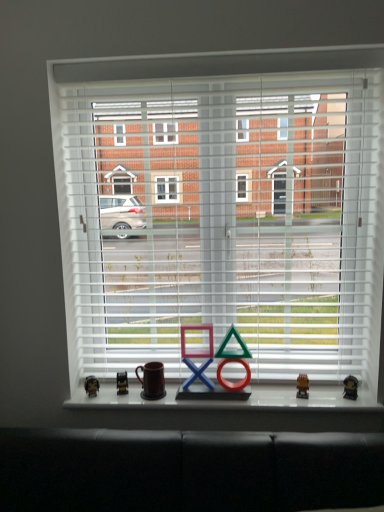
From the picture: What is the approximate height of metallic gold figurine at center, acting as the 3th miniature starting from the left?

3.14 inches.

Locate an element on the screen. The width and height of the screenshot is (384, 512). metallic gold figurine at right, which is the first miniature in right-to-left order is located at coordinates (350, 387).

What do you see at coordinates (217, 368) in the screenshot? This screenshot has width=384, height=512. I see `matte plastic game piece at center` at bounding box center [217, 368].

You are a GUI agent. You are given a task and a screenshot of the screen. Output one action in this format:
    pyautogui.click(x=<x>, y=<y>)
    Task: Click on the metallic silver figurine at lower left, the first miniature from the left
    This screenshot has width=384, height=512.
    Given the screenshot: What is the action you would take?
    pyautogui.click(x=91, y=386)

Locate an element on the screen. The height and width of the screenshot is (512, 384). metallic gold miniature at lower left, which appears as the 3th miniature when viewed from the right is located at coordinates (122, 383).

The height and width of the screenshot is (512, 384). Identify the location of metallic gold figurine at center, which is counted as the 2th miniature, starting from the right. (302, 386).

Is point (356, 383) closer or farther from the camera than point (308, 389)?

Point (356, 383) appears to be closer to the viewer than point (308, 389).

From the image's perspective, which is below, metallic gold figurine at right, which is the first miniature in right-to-left order, or metallic gold figurine at center, which is counted as the 2th miniature, starting from the right?

metallic gold figurine at right, which is the first miniature in right-to-left order, from the image's perspective.

Considering the relative sizes of metallic gold figurine at right, the fourth miniature in the left-to-right sequence, and metallic gold figurine at center, which is counted as the 2th miniature, starting from the right, in the image provided, is metallic gold figurine at right, the fourth miniature in the left-to-right sequence, thinner than metallic gold figurine at center, which is counted as the 2th miniature, starting from the right,?

Yes.

Considering the positions of objects metallic gold figurine at right, the fourth miniature in the left-to-right sequence, and metallic gold figurine at center, which is counted as the 2th miniature, starting from the right, in the image provided, who is behind, metallic gold figurine at right, the fourth miniature in the left-to-right sequence, or metallic gold figurine at center, which is counted as the 2th miniature, starting from the right,?

metallic gold figurine at center, which is counted as the 2th miniature, starting from the right.

Where is `mug to the right of metallic silver figurine at lower left, the 4th miniature when ordered from right to left`? The height and width of the screenshot is (512, 384). mug to the right of metallic silver figurine at lower left, the 4th miniature when ordered from right to left is located at coordinates (152, 380).

Is point (91, 395) behind point (148, 394)?

Yes, point (91, 395) is behind point (148, 394).

Is the depth of metallic silver figurine at lower left, the first miniature from the left, greater than that of brown matte mug at center?

Yes, the depth of metallic silver figurine at lower left, the first miniature from the left, is greater than that of brown matte mug at center.

Does metallic silver figurine at lower left, the 4th miniature when ordered from right to left, have a lesser height compared to brown matte mug at center?

Indeed, metallic silver figurine at lower left, the 4th miniature when ordered from right to left, has a lesser height compared to brown matte mug at center.

Does brown matte mug at center have a lesser height compared to matte plastic game piece at center?

Correct, brown matte mug at center is not as tall as matte plastic game piece at center.

Is brown matte mug at center located outside matte plastic game piece at center?

Yes, brown matte mug at center is not within matte plastic game piece at center.

Considering the positions of points (146, 369) and (195, 355), is point (146, 369) farther from camera compared to point (195, 355)?

Yes, it is behind point (195, 355).

Can you confirm if brown matte mug at center is bigger than matte plastic game piece at center?

No, brown matte mug at center is not bigger than matte plastic game piece at center.

Is brown matte mug at center turned away from metallic gold miniature at lower left, which appears as the second miniature when viewed from the left?

That's not correct — brown matte mug at center is not looking away from metallic gold miniature at lower left, which appears as the second miniature when viewed from the left.

How far apart are brown matte mug at center and metallic gold miniature at lower left, which appears as the second miniature when viewed from the left?

brown matte mug at center is 4.50 inches from metallic gold miniature at lower left, which appears as the second miniature when viewed from the left.

How many degrees apart are the facing directions of brown matte mug at center and metallic gold miniature at lower left, which appears as the second miniature when viewed from the left?

The angular difference between brown matte mug at center and metallic gold miniature at lower left, which appears as the second miniature when viewed from the left, is 9.72 degrees.

Is there a large distance between brown matte mug at center and metallic gold miniature at lower left, which appears as the second miniature when viewed from the left?

No, brown matte mug at center is not far away from metallic gold miniature at lower left, which appears as the second miniature when viewed from the left.

Is metallic gold figurine at center, acting as the 3th miniature starting from the left, at the right side of metallic gold figurine at right, the fourth miniature in the left-to-right sequence?

No.

Based on the photo, is metallic gold figurine at center, which is counted as the 2th miniature, starting from the right, in contact with metallic gold figurine at right, which is the first miniature in right-to-left order?

No, metallic gold figurine at center, which is counted as the 2th miniature, starting from the right, is not with metallic gold figurine at right, which is the first miniature in right-to-left order.

Does point (306, 376) come behind point (352, 381)?

Yes, it is.

Identify the location of miniature that is above the metallic gold figurine at right, the fourth miniature in the left-to-right sequence (from a real-world perspective). The height and width of the screenshot is (512, 384). 302,386.

Can you confirm if metallic gold figurine at center, which is counted as the 2th miniature, starting from the right, is bigger than matte plastic game piece at center?

No.

Does metallic gold figurine at center, acting as the 3th miniature starting from the left, appear on the left side of matte plastic game piece at center?

Incorrect, metallic gold figurine at center, acting as the 3th miniature starting from the left, is not on the left side of matte plastic game piece at center.

Does metallic gold figurine at center, which is counted as the 2th miniature, starting from the right, contain matte plastic game piece at center?

No, matte plastic game piece at center is not a part of metallic gold figurine at center, which is counted as the 2th miniature, starting from the right.

I want to click on the 2nd miniature behind the matte plastic game piece at center, counting from the anchor's position, so click(x=302, y=386).

Which object is more forward, white matte blinds at center or metallic gold figurine at right, which is the first miniature in right-to-left order?

white matte blinds at center is closer to the camera.

Locate an element on the screen. This screenshot has width=384, height=512. window blind above the metallic gold figurine at right, which is the first miniature in right-to-left order (from a real-world perspective) is located at coordinates (228, 220).

How far apart are white matte blinds at center and metallic gold figurine at right, which is the first miniature in right-to-left order?

They are 83.32 centimeters apart.

Is white matte blinds at center facing towards metallic gold figurine at right, which is the first miniature in right-to-left order?

Yes, white matte blinds at center is oriented towards metallic gold figurine at right, which is the first miniature in right-to-left order.

Locate an element on the screen. Image resolution: width=384 pixels, height=512 pixels. miniature to the right of metallic gold figurine at center, which is counted as the 2th miniature, starting from the right is located at coordinates (350, 387).

Where is `mug above the metallic silver figurine at lower left, the first miniature from the left (from a real-world perspective)`? This screenshot has width=384, height=512. mug above the metallic silver figurine at lower left, the first miniature from the left (from a real-world perspective) is located at coordinates (152, 380).

From the image, which object appears to be farther from white matte blinds at center, metallic gold miniature at lower left, which appears as the 3th miniature when viewed from the right, or matte plastic game piece at center?

metallic gold miniature at lower left, which appears as the 3th miniature when viewed from the right.

Estimate the real-world distances between objects in this image. Which object is closer to metallic gold miniature at lower left, which appears as the 3th miniature when viewed from the right, brown matte mug at center or matte plastic game piece at center?

Among the two, brown matte mug at center is located nearer to metallic gold miniature at lower left, which appears as the 3th miniature when viewed from the right.

From the image, which object appears to be farther from matte plastic game piece at center, brown matte mug at center or metallic gold miniature at lower left, which appears as the second miniature when viewed from the left?

metallic gold miniature at lower left, which appears as the second miniature when viewed from the left, is positioned further to the anchor matte plastic game piece at center.

Looking at the image, which one is located closer to matte plastic game piece at center, brown matte mug at center or metallic gold figurine at center, which is counted as the 2th miniature, starting from the right?

Among the two, brown matte mug at center is located nearer to matte plastic game piece at center.

When comparing their distances from metallic gold figurine at center, which is counted as the 2th miniature, starting from the right, does brown matte mug at center or white matte blinds at center seem closer?

brown matte mug at center is closer to metallic gold figurine at center, which is counted as the 2th miniature, starting from the right.

From the image, which object appears to be farther from metallic silver figurine at lower left, the first miniature from the left, matte plastic game piece at center or brown matte mug at center?

matte plastic game piece at center lies further to metallic silver figurine at lower left, the first miniature from the left, than the other object.

Looking at the image, which one is located closer to metallic gold miniature at lower left, which appears as the second miniature when viewed from the left, white matte blinds at center or metallic gold figurine at right, which is the first miniature in right-to-left order?

white matte blinds at center lies closer to metallic gold miniature at lower left, which appears as the second miniature when viewed from the left, than the other object.

Which object lies further to the anchor point metallic gold figurine at right, the fourth miniature in the left-to-right sequence, metallic gold miniature at lower left, which appears as the second miniature when viewed from the left, or white matte blinds at center?

Among the two, metallic gold miniature at lower left, which appears as the second miniature when viewed from the left, is located further to metallic gold figurine at right, the fourth miniature in the left-to-right sequence.

Find the location of a particular element. mug between metallic gold miniature at lower left, which appears as the 3th miniature when viewed from the right, and metallic gold figurine at center, acting as the 3th miniature starting from the left, from left to right is located at coordinates (152, 380).

Locate an element on the screen. The width and height of the screenshot is (384, 512). mug located between metallic gold miniature at lower left, which appears as the 3th miniature when viewed from the right, and metallic gold figurine at right, which is the first miniature in right-to-left order, in the left-right direction is located at coordinates (152, 380).

At what (x,y) coordinates should I click in order to perform the action: click on miniature situated between metallic silver figurine at lower left, the 4th miniature when ordered from right to left, and metallic gold figurine at center, acting as the 3th miniature starting from the left, from left to right. Please return your answer as a coordinate pair (x, y). The width and height of the screenshot is (384, 512). Looking at the image, I should click on (122, 383).

At what (x,y) coordinates should I click in order to perform the action: click on mug between metallic silver figurine at lower left, the first miniature from the left, and metallic gold figurine at right, the fourth miniature in the left-to-right sequence, in the horizontal direction. Please return your answer as a coordinate pair (x, y). Image resolution: width=384 pixels, height=512 pixels. Looking at the image, I should click on (152, 380).